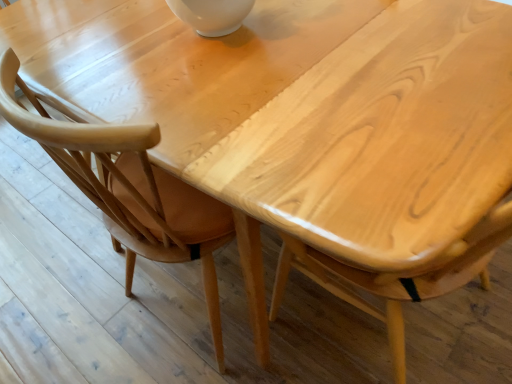
Find the location of a particular element. This screenshot has width=512, height=384. vacant space in light brown wood chair at center (from a real-world perspective) is located at coordinates (204, 308).